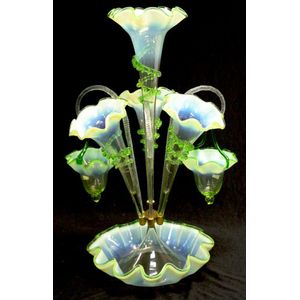
In order to click on glass stem in this screenshot , I will do `click(134, 184)`, `click(149, 172)`, `click(169, 177)`.